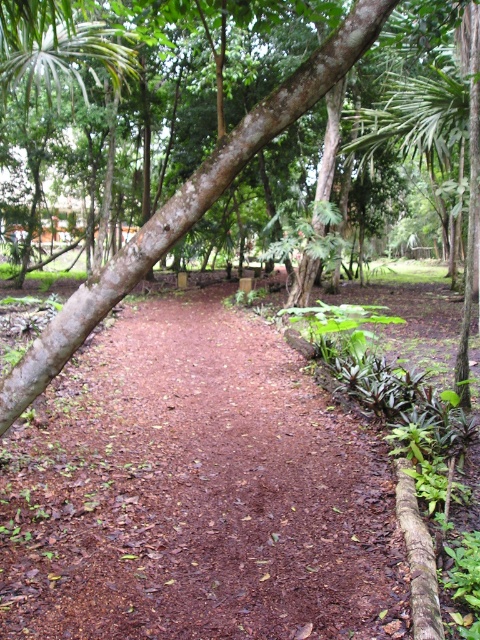
Question: Which of the following is the farthest from the observer?

Choices:
 (A) (327, 134)
 (B) (300, 458)

Answer: (A)

Question: Among these objects, which one is farthest from the camera?

Choices:
 (A) brown rough tree at center
 (B) brown dirt trail at center

Answer: (B)

Question: In this image, where is brown dirt trail at center located relative to brown rough tree at center?

Choices:
 (A) below
 (B) above

Answer: (A)

Question: Does brown dirt trail at center have a lesser width compared to brown rough tree at center?

Choices:
 (A) no
 (B) yes

Answer: (A)

Question: Is brown dirt trail at center below brown rough tree at center?

Choices:
 (A) no
 (B) yes

Answer: (B)